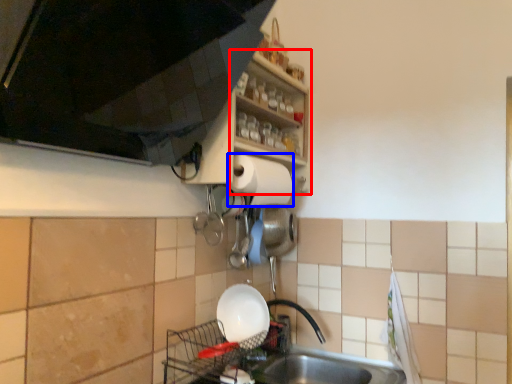
Question: Which of the following is the farthest to the observer, shelf (highlighted by a red box) or paper towel (highlighted by a blue box)?

Choices:
 (A) shelf
 (B) paper towel

Answer: (B)